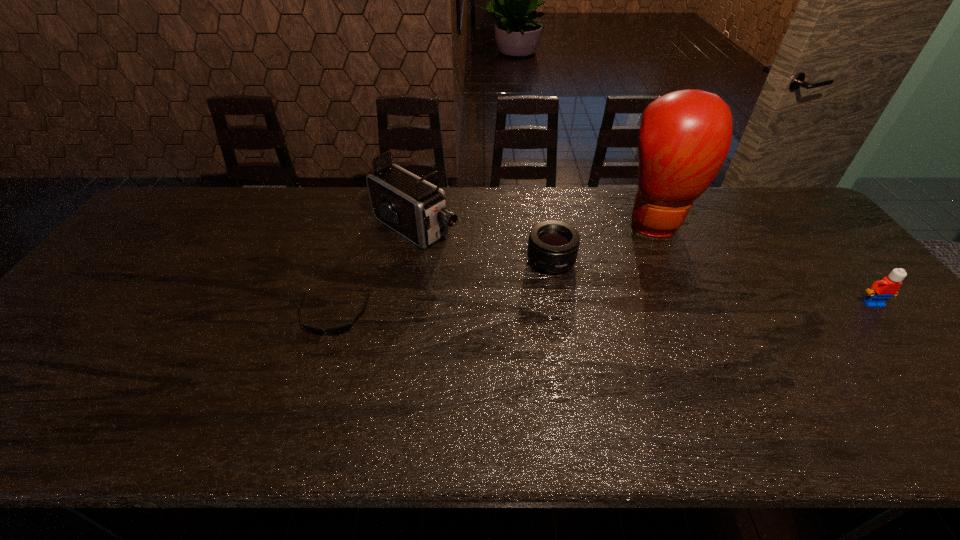
Find the location of a particular element. This screenshot has width=960, height=540. vacant region located on the side of the telephoto lens with brand markings and control switches is located at coordinates (521, 328).

Identify the location of vacant space located 0.080m on the side of the telephoto lens with brand markings and control switches. The width and height of the screenshot is (960, 540). tap(536, 295).

Image resolution: width=960 pixels, height=540 pixels. What are the coordinates of `vacant area situated 0.310m on the side of the telephoto lens with brand markings and control switches` in the screenshot? It's located at (507, 362).

This screenshot has height=540, width=960. What are the coordinates of `blank space located 0.250m at the lens of the fourth shortest object` in the screenshot? It's located at (510, 284).

The height and width of the screenshot is (540, 960). Find the location of `vacant space located at the lens of the fourth shortest object`. vacant space located at the lens of the fourth shortest object is located at coordinates (470, 259).

Locate an element on the screen. The width and height of the screenshot is (960, 540). free region located 0.390m at the lens of the fourth shortest object is located at coordinates (552, 309).

The image size is (960, 540). Identify the location of vacant space situated on the striking surface of the boxing glove. (683, 299).

Locate an element on the screen. blank space located on the striking surface of the boxing glove is located at coordinates (669, 259).

In order to click on free space located on the striking surface of the boxing glove in this screenshot , I will do `click(677, 283)`.

The width and height of the screenshot is (960, 540). Find the location of `camcorder present at the far edge`. camcorder present at the far edge is located at coordinates point(416,209).